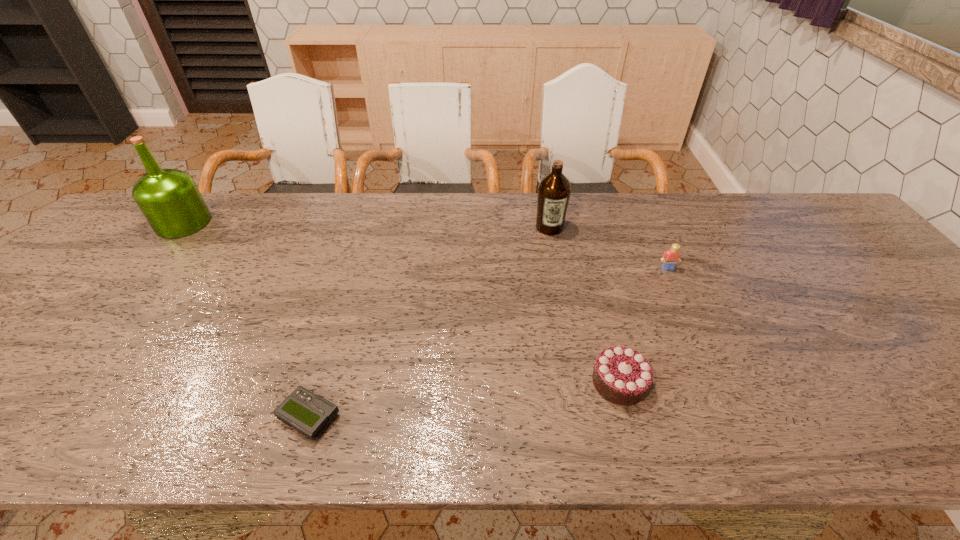
At what (x,y) coordinates should I click in order to perform the action: click on free point located on the label of the second tallest object. Please return your answer as a coordinate pair (x, y). The height and width of the screenshot is (540, 960). Looking at the image, I should click on (556, 262).

This screenshot has width=960, height=540. I want to click on blank space located on the front-facing side of the third farthest object, so click(693, 325).

I want to click on vacant region located 0.320m on the right of the chocolate cake, so click(796, 382).

Find the location of a particular element. vacant space located 0.060m on the back of the second object from left to right is located at coordinates (324, 369).

You are a GUI agent. You are given a task and a screenshot of the screen. Output one action in this format:
    pyautogui.click(x=<x>, y=<y>)
    Task: Click on the chocolate cake that is at the near edge
    
    Given the screenshot: What is the action you would take?
    pyautogui.click(x=623, y=376)

The height and width of the screenshot is (540, 960). Identify the location of beeper located in the near edge section of the desktop. (308, 413).

Identify the location of object that is at the left edge. (169, 199).

Identify the location of object present at the far left corner. This screenshot has height=540, width=960. (169, 199).

Locate an element on the screen. This screenshot has height=540, width=960. vacant point at the far edge is located at coordinates (352, 225).

Where is `vacant space at the near edge`? vacant space at the near edge is located at coordinates (587, 432).